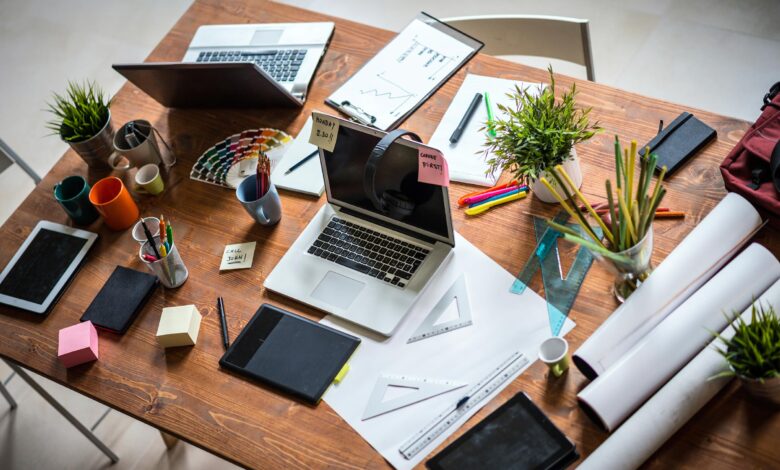
At what (x,y) coordinates should I click in order to perform the action: click on cup. Please return your answer as a coordinate pair (x, y). The height and width of the screenshot is (470, 780). Looking at the image, I should click on (x=71, y=202), (x=105, y=203), (x=147, y=180), (x=151, y=148), (x=254, y=199), (x=172, y=258), (x=143, y=235), (x=548, y=357).